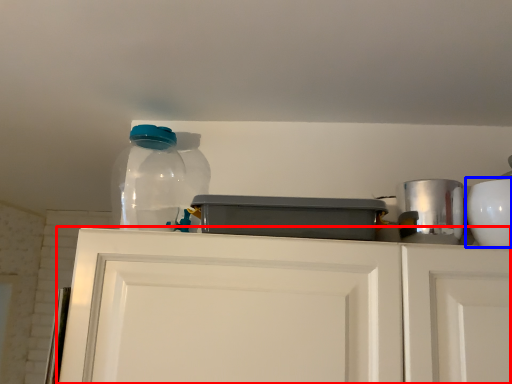
Question: Which point is closer to the camera, cabinetry (highlighted by a red box) or appliance (highlighted by a blue box)?

Choices:
 (A) cabinetry
 (B) appliance

Answer: (A)